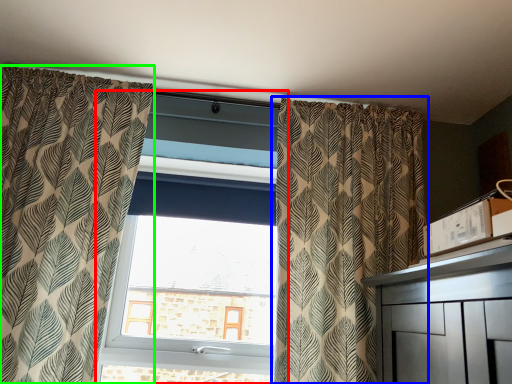
Question: Considering the real-world distances, which object is farthest from window (highlighted by a red box)? curtain (highlighted by a blue box) or curtain (highlighted by a green box)?

Choices:
 (A) curtain
 (B) curtain

Answer: (A)